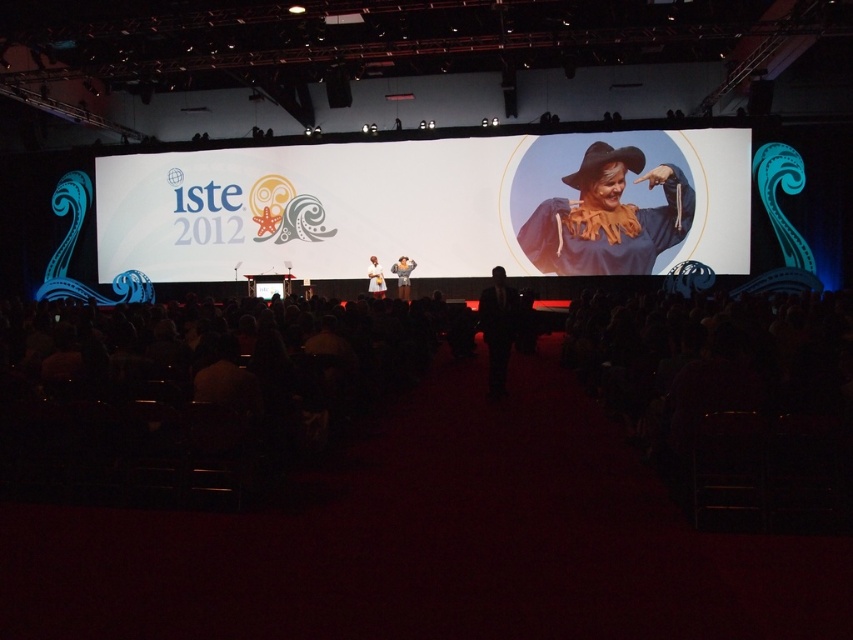
Can you confirm if matte yellow scarecrow at upper right is positioned to the left of black suit at center?

Incorrect, matte yellow scarecrow at upper right is not on the left side of black suit at center.

Which of these two, matte yellow scarecrow at upper right or black suit at center, stands shorter?

black suit at center

Who is more distant from viewer, [653,244] or [492,282]?

Positioned behind is point [492,282].

Where is `matte yellow scarecrow at upper right`? Image resolution: width=853 pixels, height=640 pixels. matte yellow scarecrow at upper right is located at coordinates (607, 218).

Who is positioned more to the right, black plastic chairs at center or white paper at center?

From the viewer's perspective, black plastic chairs at center appears more on the right side.

Which is in front, point (735, 401) or point (621, 147)?

Point (735, 401) is in front.

Is point (149, 449) farther from viewer compared to point (267, 164)?

No, (149, 449) is closer to viewer.

Locate an element on the screen. Image resolution: width=853 pixels, height=640 pixels. black plastic chairs at center is located at coordinates (178, 406).

The image size is (853, 640). What do you see at coordinates (428, 205) in the screenshot?
I see `white paper at center` at bounding box center [428, 205].

Between white paper at center and matte yellow scarecrow at upper right, which one is positioned higher?

white paper at center

Does point (399, 198) come behind point (599, 198)?

Yes, it is behind point (599, 198).

This screenshot has width=853, height=640. Find the location of `white paper at center`. white paper at center is located at coordinates (428, 205).